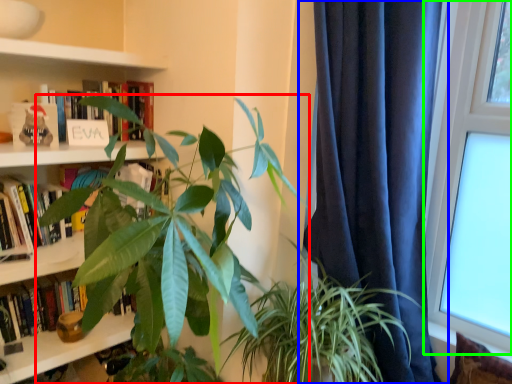
Question: Estimate the real-world distances between objects in this image. Which object is closer to houseplant (highlighted by a red box), curtain (highlighted by a blue box) or window (highlighted by a green box)?

Choices:
 (A) curtain
 (B) window

Answer: (A)